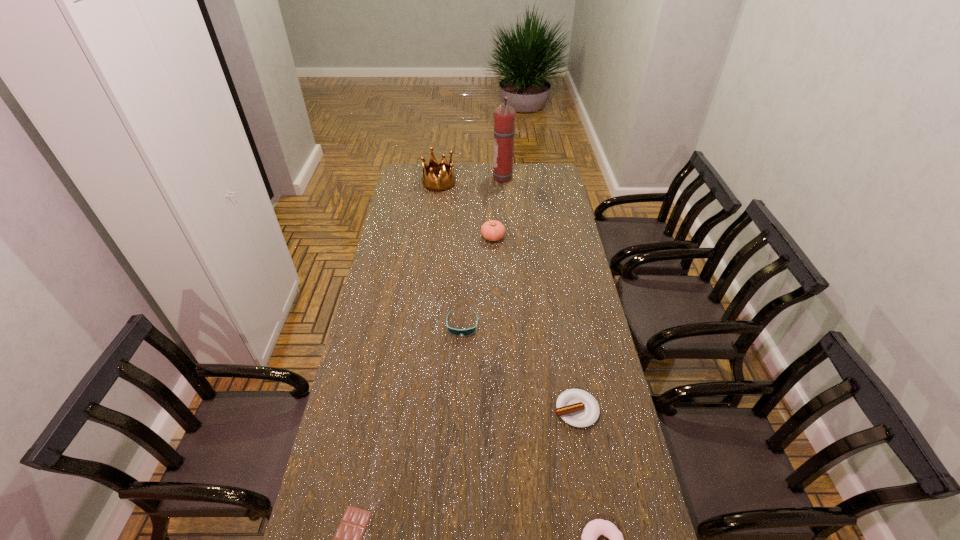
You are a GUI agent. You are given a task and a screenshot of the screen. Output one action in this format:
    pyautogui.click(x=<x>, y=<y>)
    Task: Click on the tallest object
    
    Given the screenshot: What is the action you would take?
    pyautogui.click(x=504, y=116)

Where is `the sixth shortest object`? The height and width of the screenshot is (540, 960). the sixth shortest object is located at coordinates (446, 180).

Where is `tomato`? The height and width of the screenshot is (540, 960). tomato is located at coordinates (492, 230).

Image resolution: width=960 pixels, height=540 pixels. Find the location of `the third farthest object`. the third farthest object is located at coordinates (492, 230).

Identify the location of the fifth object from right to left. This screenshot has width=960, height=540. (457, 332).

Find the location of a particular element. This screenshot has height=540, width=960. sunglasses is located at coordinates (457, 332).

The image size is (960, 540). Identify the location of the third nearest object. (578, 408).

What are the coordinates of `free space located 0.370m on the side of the tallest object with the label and nozzle` in the screenshot? It's located at (425, 178).

You are a GUI agent. You are given a task and a screenshot of the screen. Output one action in this format:
    pyautogui.click(x=<x>, y=<y>)
    Task: Click on the free region located on the side of the tallest object with the label and nozzle
    
    Given the screenshot: What is the action you would take?
    pyautogui.click(x=478, y=178)

The image size is (960, 540). I want to click on vacant space situated on the side of the tallest object with the label and nozzle, so click(464, 178).